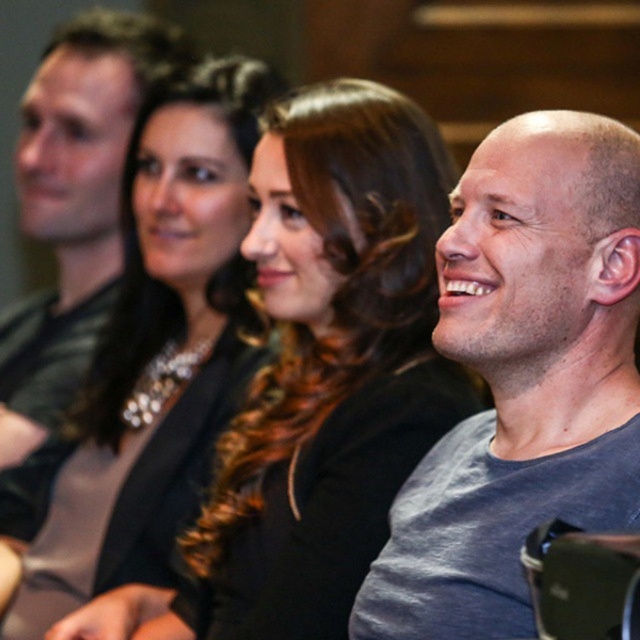
Question: Which of the following is the farthest from the observer?

Choices:
 (A) (214, 428)
 (B) (422, 161)

Answer: (A)

Question: Which point is closer to the camera?

Choices:
 (A) matte black jacket at center
 (B) gray cotton t-shirt at center

Answer: (B)

Question: Which of these objects is positioned closest to the matte black jacket at center?

Choices:
 (A) gray cotton t-shirt at center
 (B) black satin jacket at upper center

Answer: (B)

Question: Does matte black jacket at center have a larger size compared to black satin jacket at upper center?

Choices:
 (A) no
 (B) yes

Answer: (A)

Question: Does matte black jacket at center appear on the left side of gray cotton t-shirt at center?

Choices:
 (A) yes
 (B) no

Answer: (A)

Question: Does matte black jacket at center have a greater width compared to gray cotton t-shirt at center?

Choices:
 (A) yes
 (B) no

Answer: (A)